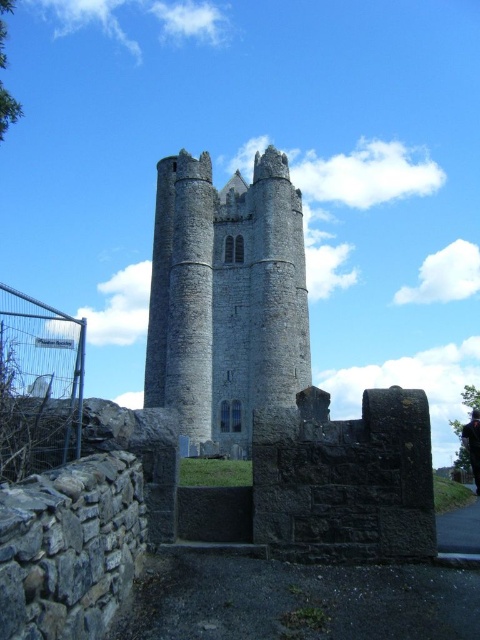
You are a visitor approaching the gray stone tower at center and the metal wire fence at lower left. Based on the scene, which object is closer to you as you approach the tower?

The gray stone tower at center is closer to you than the metal wire fence at lower left, so the gray stone tower at center would be the first object you encounter as you approach.

You are standing in front of the image and want to locate the gray stone tower at center. What are its coordinates in the image?

The gray stone tower at center is located at coordinates point [226,296].

You are standing at the entrance of the area and see the gray stone tower at center and the metal wire fence at lower left. Which object is positioned to the right of the other?

The gray stone tower at center is positioned to the right of the metal wire fence at lower left.